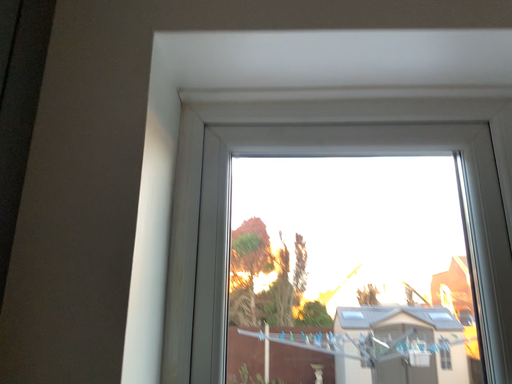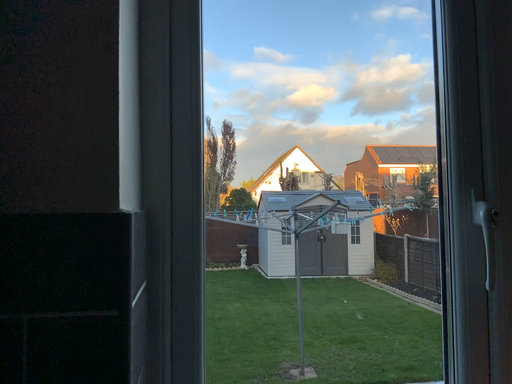
Question: How did the camera likely rotate when shooting the video?

Choices:
 (A) rotated right
 (B) rotated left

Answer: (A)